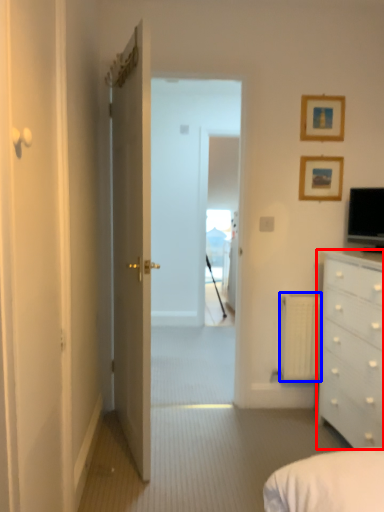
Question: Which object appears closest to the camera in this image, chest of drawers (highlighted by a red box) or radiator (highlighted by a blue box)?

Choices:
 (A) chest of drawers
 (B) radiator

Answer: (A)